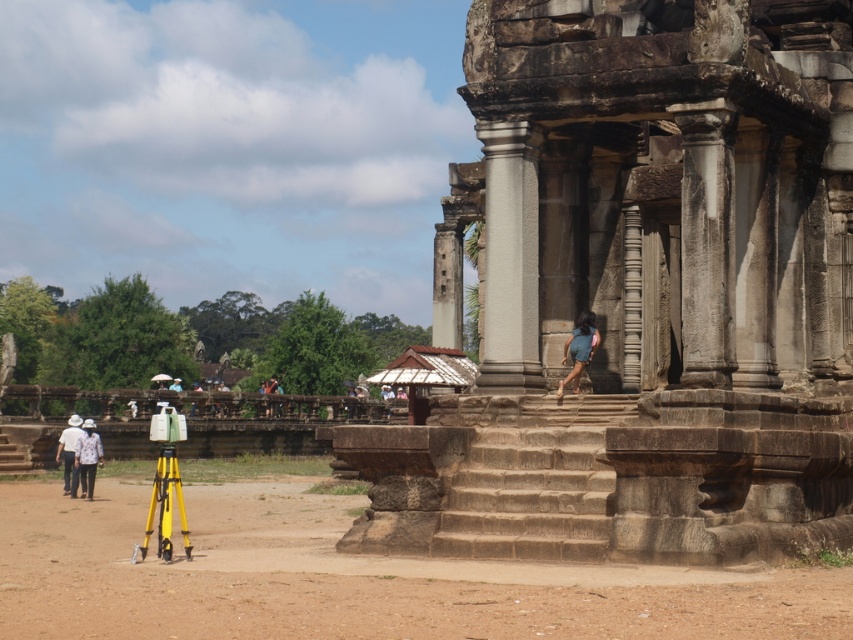
Question: Is blue denim shorts at center wider than white fabric hat at lower left?

Choices:
 (A) yes
 (B) no

Answer: (B)

Question: Which of these objects is positioned farthest from the gray stone ruins at center?

Choices:
 (A) white stone column at center
 (B) white fabric person at lower left

Answer: (B)

Question: Which point is farther to the camera?

Choices:
 (A) (585, 358)
 (B) (67, 486)
 (C) (514, 349)
 (D) (83, 436)

Answer: (B)

Question: Does gray stone ruins at center have a smaller size compared to white fabric hat at lower left?

Choices:
 (A) yes
 (B) no

Answer: (B)

Question: Considering the real-world distances, which object is farthest from the white stone column at center?

Choices:
 (A) gray stone ruins at center
 (B) white fabric person at lower left
 (C) white fabric hat at lower left

Answer: (C)

Question: Does gray stone ruins at center lie in front of white fabric hat at lower left?

Choices:
 (A) yes
 (B) no

Answer: (A)